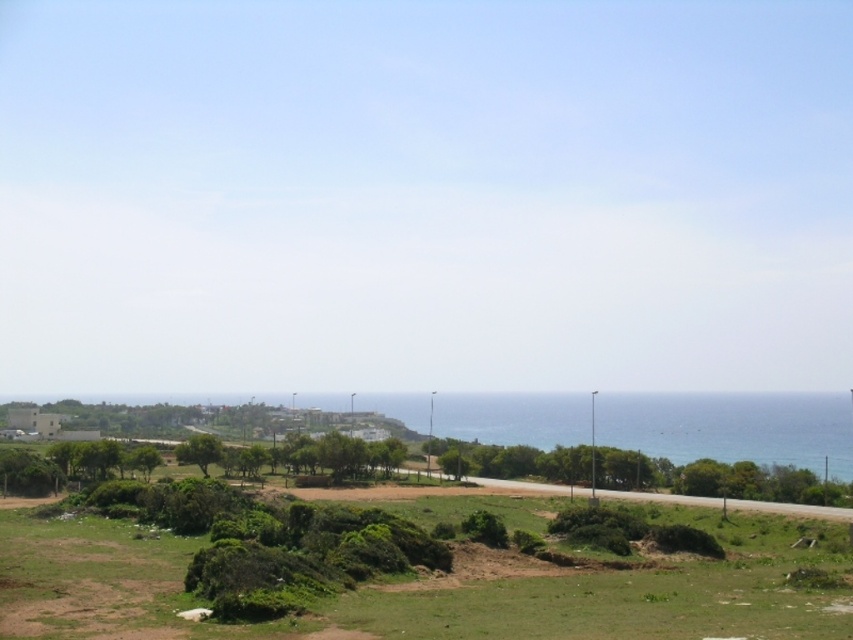
You are standing on the paved road in the middle ground of the coastal landscape. You see the green leafy tree at lower center and the green leafy tree at lower left. Which tree is closer to you?

The green leafy tree at lower center is closer to you because it is positioned in front of the green leafy tree at lower left.

You are a hiker standing at the edge of the grassy area in the coastal landscape. You want to take a photo of both the green leafy tree at lower center and the green leafy tree at lower left. Which tree should you move closer to in order to include both in your frame without zooming in?

You should move closer to the green leafy tree at lower left since it is smaller in size compared to the green leafy tree at lower center. This will help balance their sizes in the photo frame.